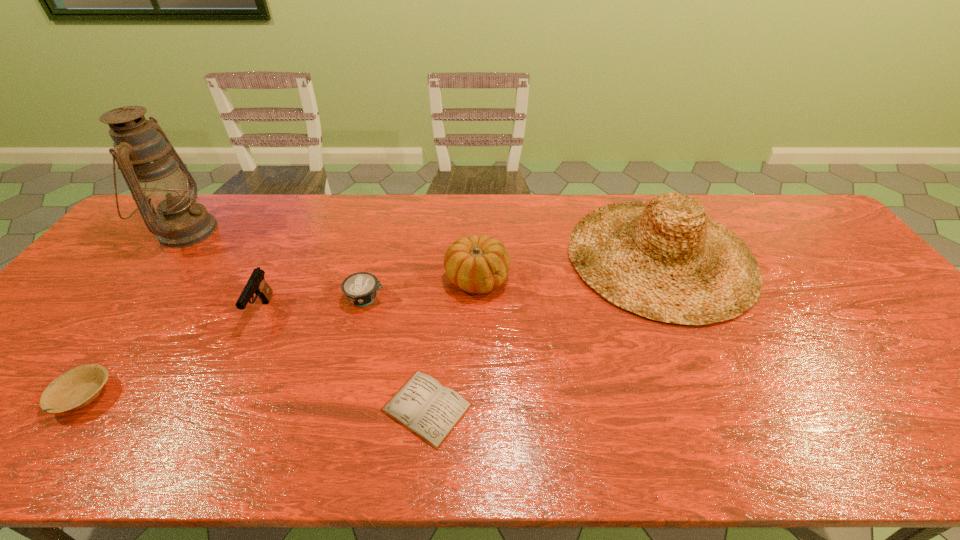
Image resolution: width=960 pixels, height=540 pixels. Identify the location of vacant area situated on the front of the second tallest object. (701, 347).

The height and width of the screenshot is (540, 960). In order to click on vacant position located on the back of the gourd in this screenshot , I will do `click(477, 216)`.

The image size is (960, 540). Identify the location of free space located at the barrel of the third object from left to right. (201, 441).

Image resolution: width=960 pixels, height=540 pixels. In order to click on vacant space situated on the front of the yogurt in this screenshot , I will do `click(344, 387)`.

Locate an element on the screen. The width and height of the screenshot is (960, 540). vacant space located on the back of the bowl is located at coordinates (147, 309).

Where is `free space located 0.180m on the left of the diary`? free space located 0.180m on the left of the diary is located at coordinates (299, 407).

Find the location of a particular element. The image size is (960, 540). oil lamp at the far edge is located at coordinates (156, 176).

Locate an element on the screen. The height and width of the screenshot is (540, 960). sunhat that is positioned at the far edge is located at coordinates (666, 260).

I want to click on bowl located at the near edge, so click(x=78, y=387).

Locate an element on the screen. This screenshot has width=960, height=540. diary that is at the near edge is located at coordinates (424, 406).